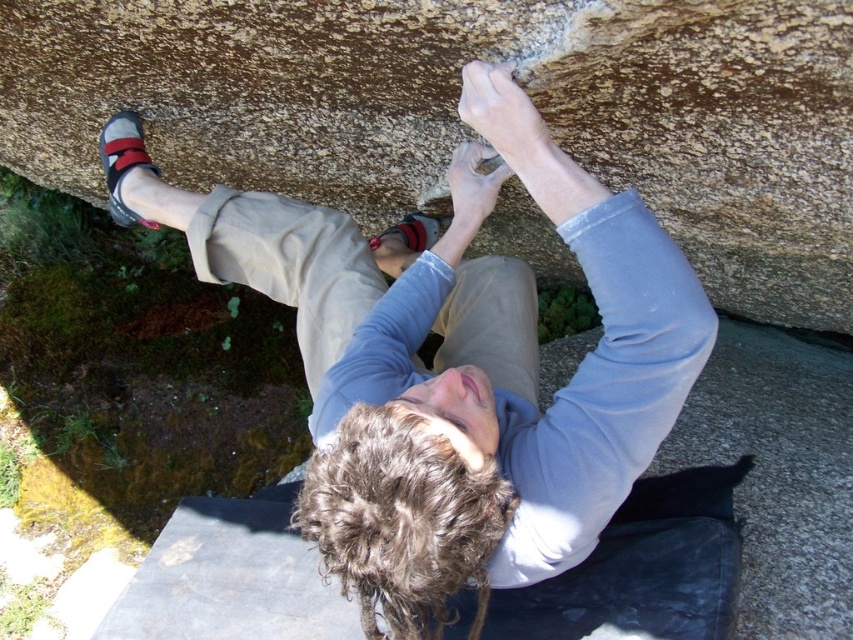
Which of these two, brown rough rock at upper center or matte gray climbing shoe at upper left, stands shorter?

brown rough rock at upper center

The width and height of the screenshot is (853, 640). I want to click on brown rough rock at upper center, so click(x=456, y=115).

Describe the element at coordinates (456, 115) in the screenshot. I see `brown rough rock at upper center` at that location.

The width and height of the screenshot is (853, 640). I want to click on brown rough rock at upper center, so click(x=456, y=115).